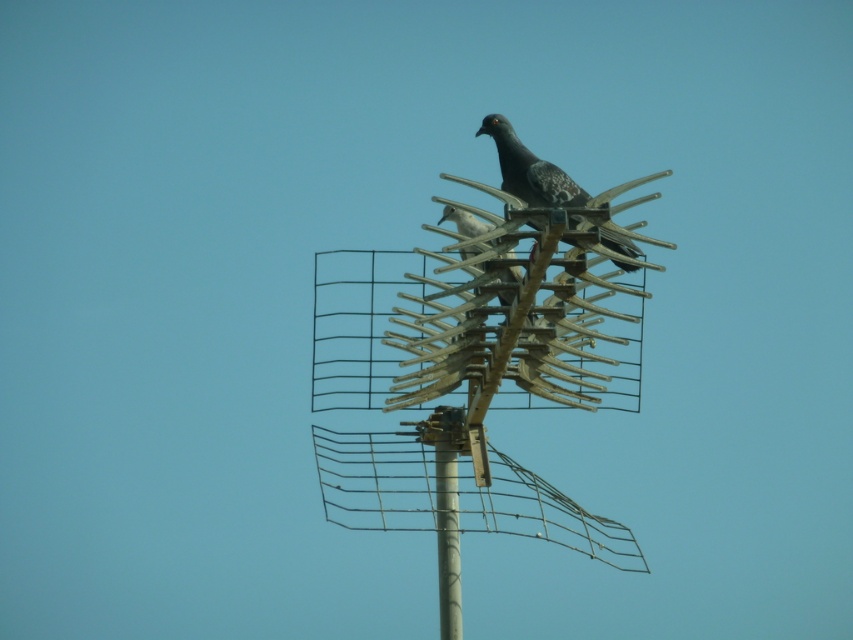
Question: Is speckled feathered bird at center positioned behind speckled feathered pigeon at center?

Choices:
 (A) yes
 (B) no

Answer: (B)

Question: From the image, what is the correct spatial relationship of speckled feathered bird at center in relation to speckled feathered pigeon at center?

Choices:
 (A) left
 (B) right

Answer: (B)

Question: Does speckled feathered bird at center have a larger size compared to speckled feathered pigeon at center?

Choices:
 (A) yes
 (B) no

Answer: (A)

Question: Which point is farther to the camera?

Choices:
 (A) (502, 134)
 (B) (467, 256)

Answer: (A)

Question: Which point appears closest to the camera in this image?

Choices:
 (A) (479, 220)
 (B) (561, 195)

Answer: (B)